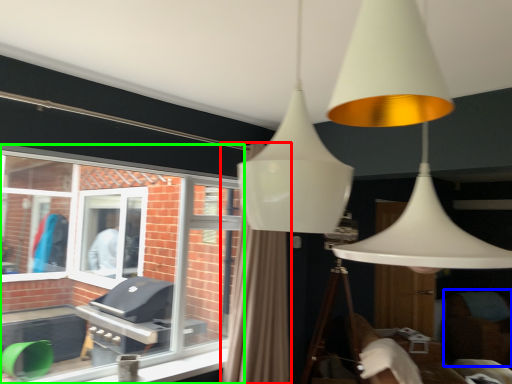
Question: Which object is the closest to the curtain (highlighted by a red box)? Choose among these: swivel chair (highlighted by a blue box) or window (highlighted by a green box).

Choices:
 (A) swivel chair
 (B) window

Answer: (B)